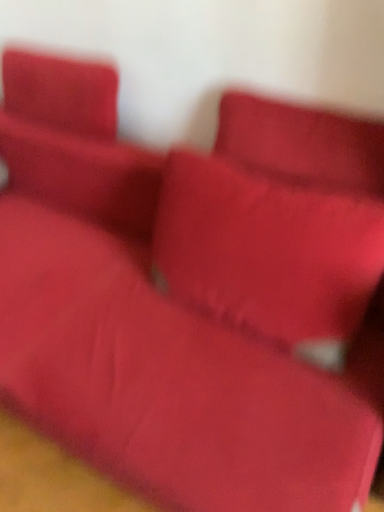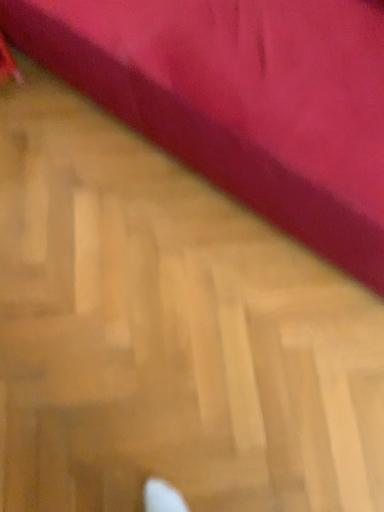
Question: How did the camera likely rotate when shooting the video?

Choices:
 (A) rotated downward
 (B) rotated upward

Answer: (A)